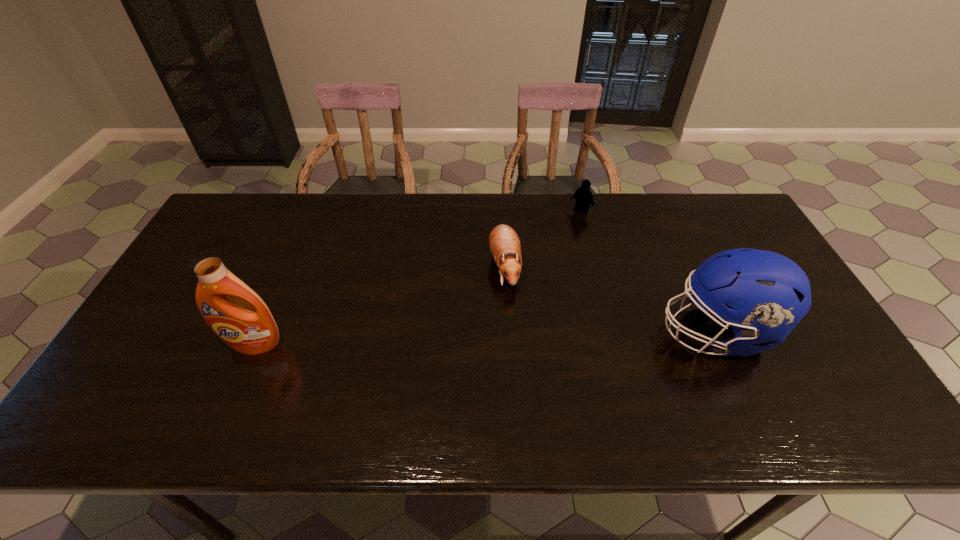
The image size is (960, 540). I want to click on free location located on the front-facing side of the third shortest object, so click(609, 332).

Locate an element on the screen. The image size is (960, 540). free space located 0.120m on the face of the Lego is located at coordinates (559, 233).

The image size is (960, 540). Find the location of `vacant space located on the face of the Lego`. vacant space located on the face of the Lego is located at coordinates (569, 222).

Find the location of a particular element. vacant space located on the face of the Lego is located at coordinates (532, 264).

You are a GUI agent. You are given a task and a screenshot of the screen. Output one action in this format:
    pyautogui.click(x=<x>, y=<y>)
    Task: Click on the free location located at the face of the hamster
    This screenshot has width=960, height=540.
    Given the screenshot: What is the action you would take?
    pyautogui.click(x=509, y=341)

Find the location of a particular element. vacant space located at the face of the hamster is located at coordinates (507, 313).

Identify the location of blank space located at the face of the hamster. Image resolution: width=960 pixels, height=540 pixels. (507, 319).

Locate an element on the screen. Image resolution: width=960 pixels, height=540 pixels. object at the far edge is located at coordinates (583, 195).

This screenshot has width=960, height=540. I want to click on object that is at the near edge, so click(x=768, y=293).

In order to click on object that is at the right edge in this screenshot , I will do `click(768, 293)`.